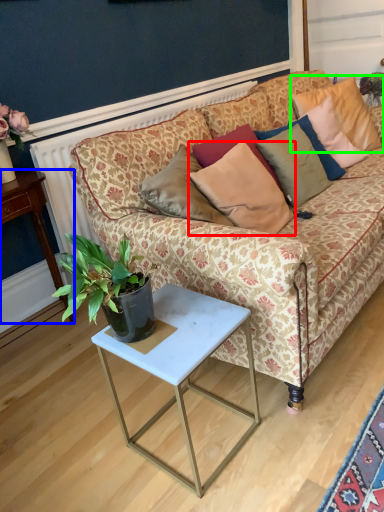
Question: Considering the real-world distances, which object is closest to pillow (highlighted by a red box)? desk (highlighted by a blue box) or pillow (highlighted by a green box).

Choices:
 (A) desk
 (B) pillow

Answer: (A)